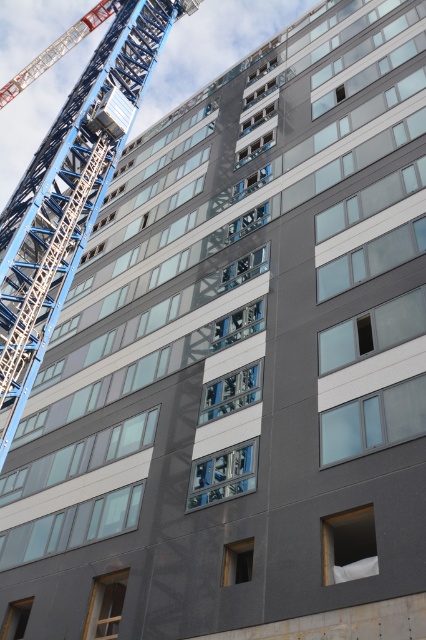
You are a construction worker standing on the ground floor of the high rise building. You need to determine which equipment is taller between the blue metallic crane at upper left and the matte black lift at upper left. Which one is taller?

The blue metallic crane at upper left is taller than the matte black lift at upper left.

You are a construction worker standing near the blue metallic crane at upper left and the matte black lift at upper left. You need to attach a safety harness to the nearest structure. Which one should you choose?

The blue metallic crane at upper left is closer to the viewer than the matte black lift at upper left, so you should attach the safety harness to the blue metallic crane at upper left.

You are an architect standing on the ground floor of the building and looking up at the blue metallic crane at upper left and the red painted metal crane arm at upper left. Which object is closer to your eyes?

The blue metallic crane at upper left is closer to your eyes because it is positioned below the red painted metal crane arm at upper left, indicating it is in a lower vertical plane.